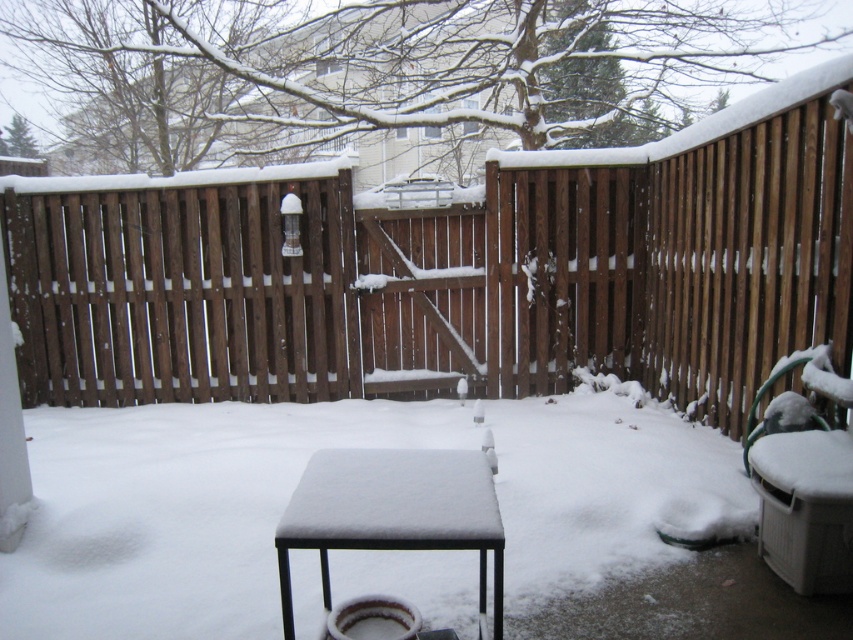
Does brown wooden fence at center appear under snow-covered metal picnic table at center?

No.

Which of these two, brown wooden fence at center or snow-covered metal picnic table at center, stands taller?

brown wooden fence at center

Find the location of a particular element. brown wooden fence at center is located at coordinates (453, 273).

Where is `brown wooden fence at center`? The height and width of the screenshot is (640, 853). brown wooden fence at center is located at coordinates 453,273.

Can you confirm if snow-covered metal picnic table at center is taller than white plastic chair at right?

In fact, snow-covered metal picnic table at center may be shorter than white plastic chair at right.

Does snow-covered metal picnic table at center have a smaller size compared to white plastic chair at right?

Yes.

Does point (340, 456) come closer to viewer compared to point (805, 513)?

Yes, point (340, 456) is in front of point (805, 513).

This screenshot has height=640, width=853. Identify the location of snow-covered metal picnic table at center. (392, 512).

Can you confirm if brown wooden fence at center is bigger than white plastic chair at right?

Indeed, brown wooden fence at center has a larger size compared to white plastic chair at right.

Is brown wooden fence at center wider than white plastic chair at right?

Indeed, brown wooden fence at center has a greater width compared to white plastic chair at right.

Does point (654, 157) come farther from viewer compared to point (822, 522)?

Yes, point (654, 157) is farther from viewer.

Locate an element on the screen. This screenshot has width=853, height=640. brown wooden fence at center is located at coordinates (453, 273).